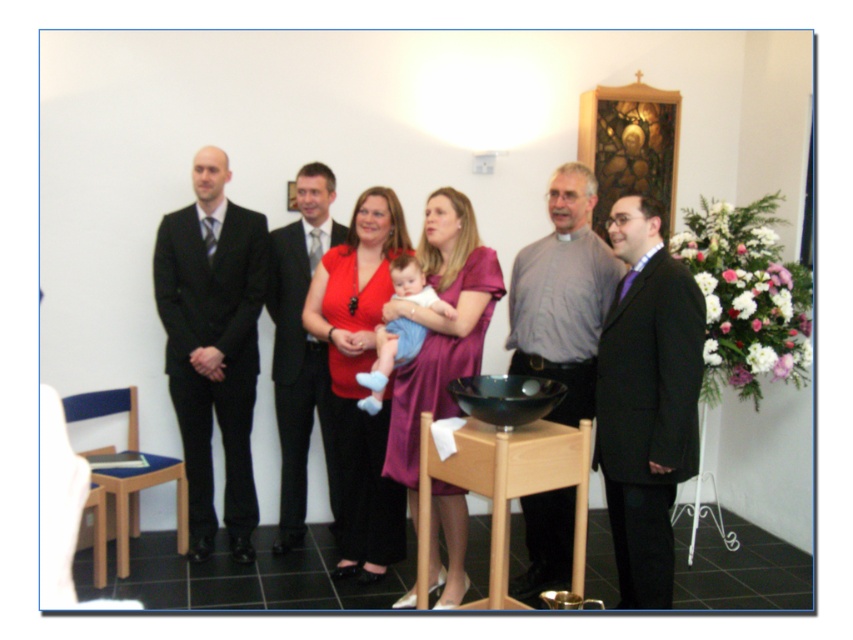
Who is higher up, matte black suit at right or purple satin dress at center?

Positioned higher is purple satin dress at center.

Can you confirm if matte black suit at right is smaller than purple satin dress at center?

Correct, matte black suit at right occupies less space than purple satin dress at center.

Locate an element on the screen. The width and height of the screenshot is (853, 640). matte black suit at right is located at coordinates (646, 400).

Is matte black suit at center thinner than purple satin dress at center?

No.

I want to click on matte black suit at center, so click(428, 369).

Identify the location of matte black suit at center. This screenshot has width=853, height=640. (428, 369).

Does black suit at left lie in front of matte red dress at center?

No, black suit at left is further to the viewer.

Who is more distant from viewer, (247, 209) or (363, 333)?

The point (247, 209) is more distant.

The image size is (853, 640). What are the coordinates of `black suit at left` in the screenshot? It's located at (212, 344).

You are a GUI agent. You are given a task and a screenshot of the screen. Output one action in this format:
    pyautogui.click(x=<x>, y=<y>)
    Task: Click on the black suit at left
    This screenshot has height=640, width=853.
    Given the screenshot: What is the action you would take?
    pyautogui.click(x=212, y=344)